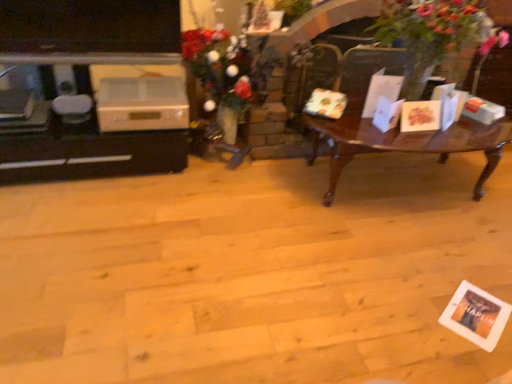
Image resolution: width=512 pixels, height=384 pixels. Identify the location of vacant space to the right of white glossy entertainment center at left. (215, 207).